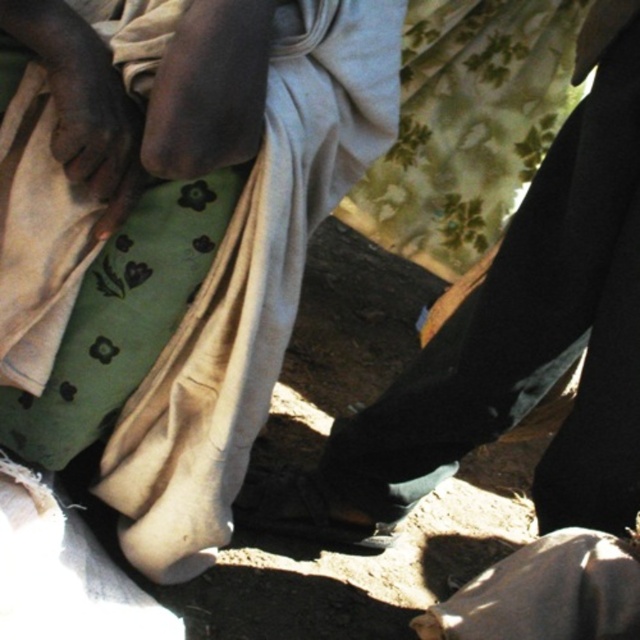
You are a photographer setting up a shoot in this scene. You need to ensure that the green fabric at center does not block the view of the black leather shoe at center. Is the current arrangement acceptable?

The green fabric at center is above the black leather shoe at center, so it might block the view. Adjust the position of the green fabric at center to lower it or move it aside to ensure the black leather shoe at center is visible.

You are planning to place a small book on the ground between the green fabric at center and the black leather shoe at center. Considering their widths, which object should you place the book closer to to ensure it fits within the space?

The green fabric at center has a smaller width than the black leather shoe at center, so placing the book closer to the green fabric at center would ensure it fits within the available space.

You are a photographer setting up a shoot in this scene. You need to place a small prop between the green fabric at center and the black leather shoe at center. How far apart are these two items to ensure the prop fits comfortably?

The green fabric at center and the black leather shoe at center are 14.29 inches apart. To ensure the prop fits comfortably, place it within this distance.